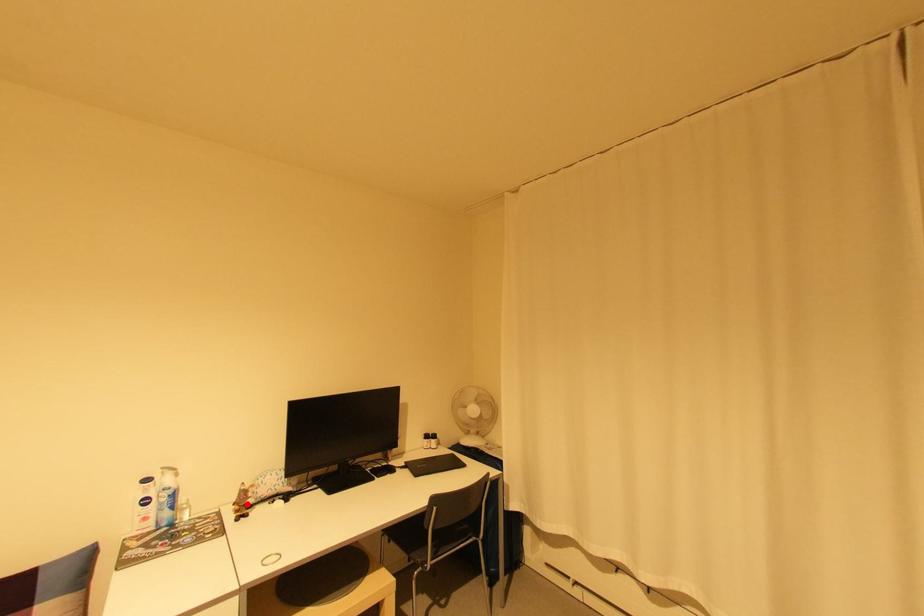
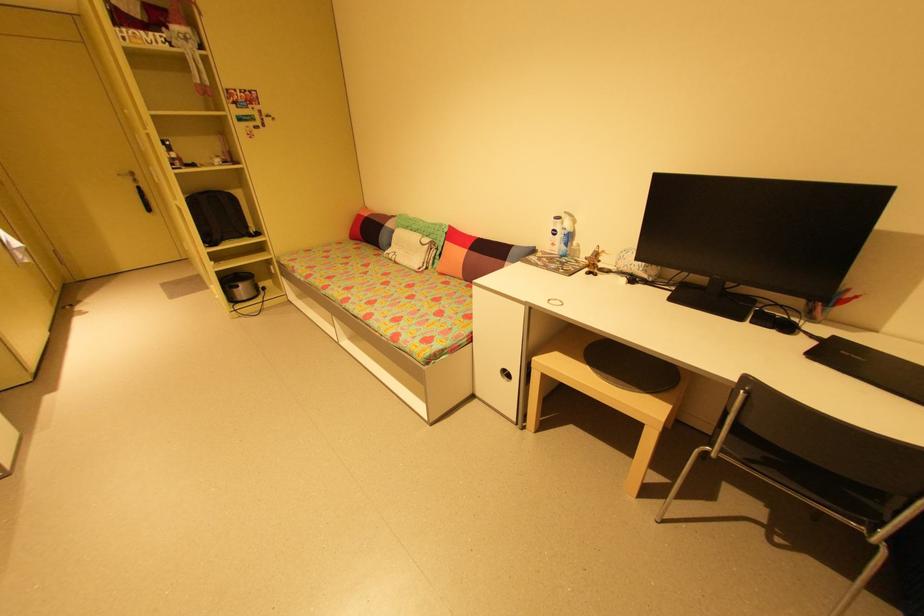
Find the pixel in the second image that matches the highlighted location in the first image.

(597, 262)